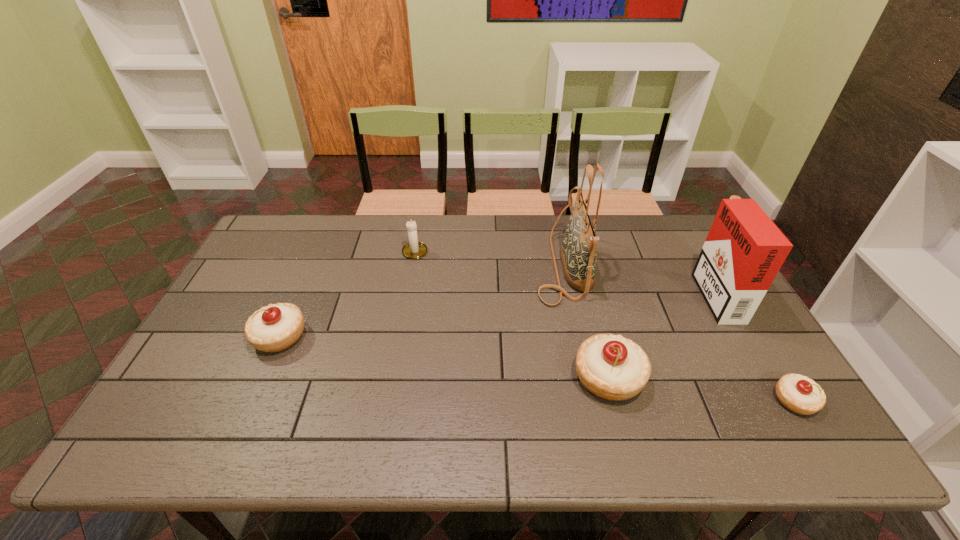
Find the location of a particular element. The height and width of the screenshot is (540, 960). the leftmost object is located at coordinates (276, 327).

At what (x,y) coordinates should I click in order to perform the action: click on the second shortest pastry. Please return your answer as a coordinate pair (x, y). Looking at the image, I should click on (276, 327).

Identify the location of the second pastry from right to left. The height and width of the screenshot is (540, 960). (612, 367).

This screenshot has height=540, width=960. Find the location of `the shortest object`. the shortest object is located at coordinates (799, 394).

You are a GUI agent. You are given a task and a screenshot of the screen. Output one action in this format:
    pyautogui.click(x=<x>, y=<y>)
    Task: Click on the rightmost pastry
    
    Given the screenshot: What is the action you would take?
    pyautogui.click(x=799, y=394)

Find the location of a particular element. This screenshot has height=540, width=960. the second object from left to right is located at coordinates (413, 250).

You are a GUI agent. You are given a task and a screenshot of the screen. Output one action in this format:
    pyautogui.click(x=<x>, y=<y>)
    Task: Click on the handbag
    This screenshot has width=960, height=540.
    Given the screenshot: What is the action you would take?
    pyautogui.click(x=578, y=252)

You are a GUI agent. You are given a task and a screenshot of the screen. Output one action in this format:
    pyautogui.click(x=<x>, y=<y>)
    Task: Click on the second tallest object
    This screenshot has height=540, width=960.
    Given the screenshot: What is the action you would take?
    pyautogui.click(x=744, y=250)

Where is `blank area located 0.360m on the back of the leftmost object`? blank area located 0.360m on the back of the leftmost object is located at coordinates (322, 240).

Identify the location of blank space located on the right of the second pastry from right to left. (747, 377).